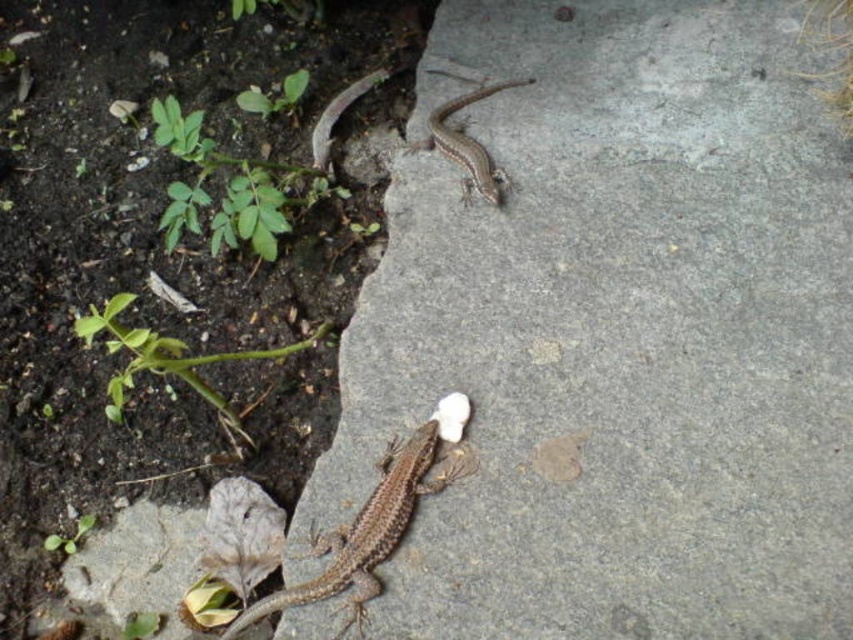
Between smooth concrete stone at center and brown scaly lizard at center, which one is positioned higher?

Positioned higher is smooth concrete stone at center.

Can you confirm if smooth concrete stone at center is wider than brown scaly lizard at center?

Correct, the width of smooth concrete stone at center exceeds that of brown scaly lizard at center.

I want to click on smooth concrete stone at center, so click(614, 333).

Locate an element on the screen. The width and height of the screenshot is (853, 640). smooth concrete stone at center is located at coordinates (614, 333).

Can you confirm if brown scaly lizard at center is bigger than brown scaly lizard at upper center?

Indeed, brown scaly lizard at center has a larger size compared to brown scaly lizard at upper center.

Does brown scaly lizard at center appear under brown scaly lizard at upper center?

Yes.

Where is `brown scaly lizard at center`? brown scaly lizard at center is located at coordinates (368, 529).

Is smooth concrete stone at center to the left of brown scaly lizard at upper center from the viewer's perspective?

No, smooth concrete stone at center is not to the left of brown scaly lizard at upper center.

Between smooth concrete stone at center and brown scaly lizard at upper center, which one has less height?

With less height is brown scaly lizard at upper center.

The width and height of the screenshot is (853, 640). What do you see at coordinates (614, 333) in the screenshot?
I see `smooth concrete stone at center` at bounding box center [614, 333].

The image size is (853, 640). I want to click on smooth concrete stone at center, so click(614, 333).